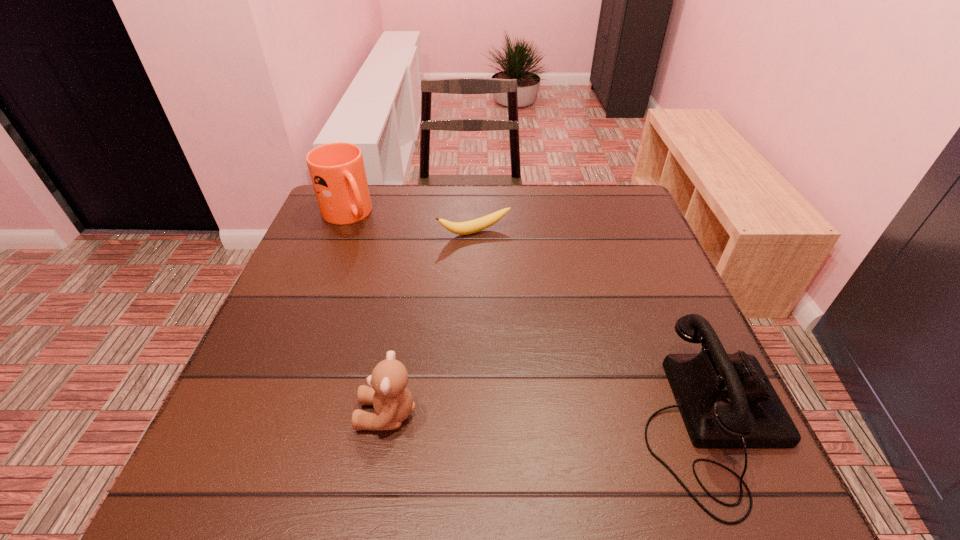
Locate an element on the screen. The height and width of the screenshot is (540, 960). teddy bear is located at coordinates (392, 401).

At what (x,y) coordinates should I click in order to perform the action: click on telephone. Please return your answer as a coordinate pair (x, y). The height and width of the screenshot is (540, 960). Looking at the image, I should click on (726, 400).

The image size is (960, 540). Find the location of `the third object from left to right`. the third object from left to right is located at coordinates (469, 227).

Find the location of a particular element. This screenshot has width=960, height=540. the shortest object is located at coordinates (469, 227).

Locate an element on the screen. Image resolution: width=960 pixels, height=540 pixels. mug is located at coordinates [337, 171].

Where is `the leftmost object`? the leftmost object is located at coordinates (337, 171).

This screenshot has height=540, width=960. Identify the location of vacant space located on the front-facing side of the third object from right to left. (223, 414).

The width and height of the screenshot is (960, 540). Identify the location of vacant space located 0.230m on the front-facing side of the third object from right to left. (228, 414).

Find the location of `blank space located on the front-facing side of the third object from right to left`. blank space located on the front-facing side of the third object from right to left is located at coordinates (223, 414).

In order to click on free spot located on the upward curve of the shortest object in this screenshot , I will do `click(530, 307)`.